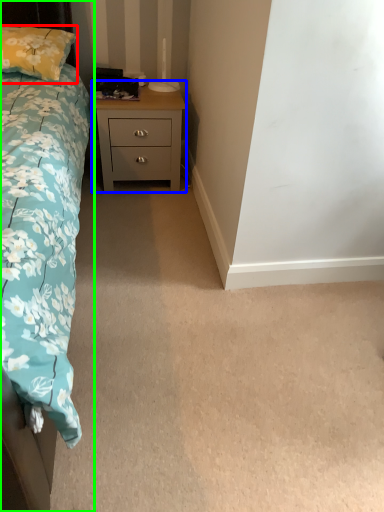
Question: Which object is positioned farthest from pillow (highlighted by a red box)? Select from nightstand (highlighted by a blue box) and bed (highlighted by a green box).

Choices:
 (A) nightstand
 (B) bed

Answer: (B)